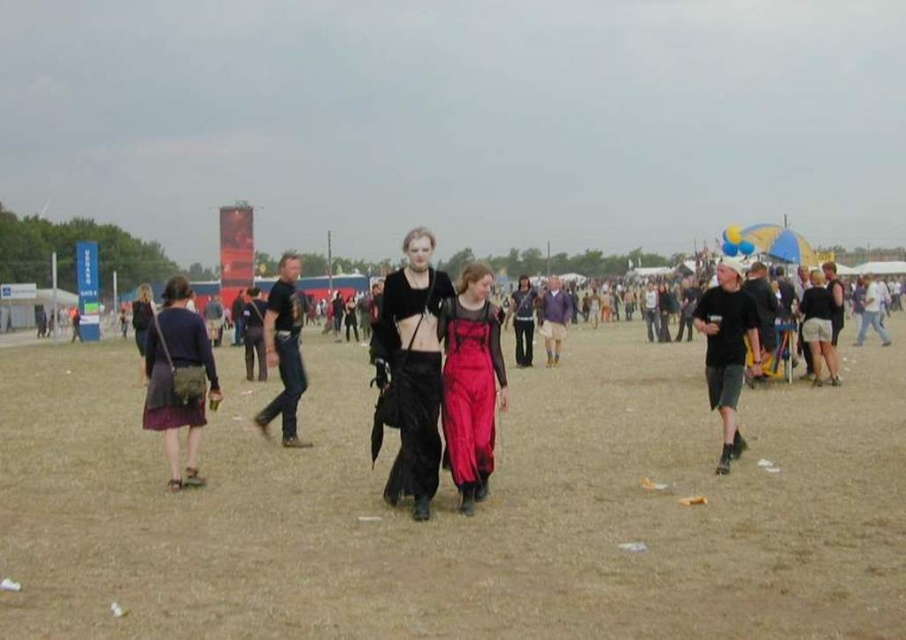
You are a photographer at the festival trying to capture a photo of the satin dress at center without the brown sandy ground at center showing in the frame. Is this possible based on their positions?

The brown sandy ground at center is below the satin dress at center, so it might be challenging to capture the dress without the ground appearing in the frame unless the photographer adjusts the angle to exclude the lower part of the dress or the ground.